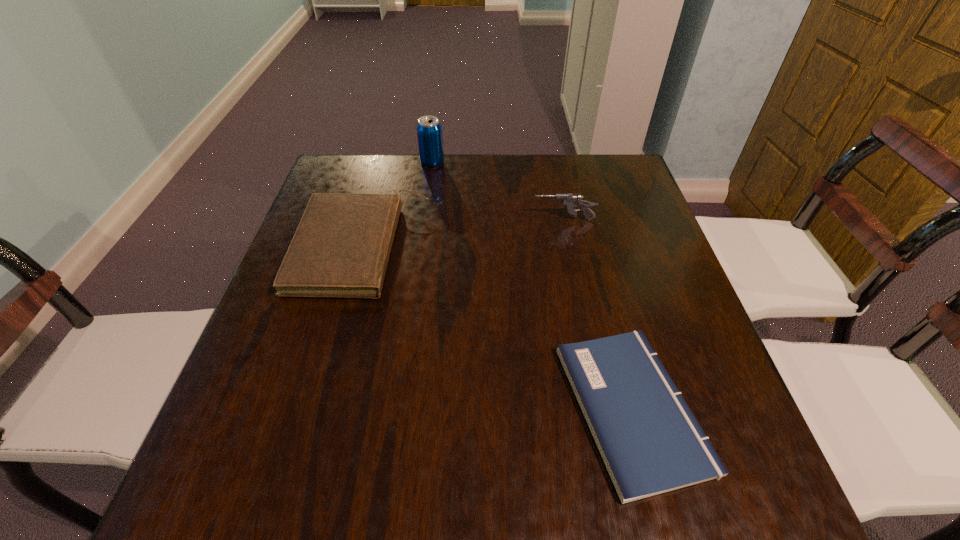
The image size is (960, 540). I want to click on the tallest object, so click(429, 130).

Identify the location of the farthest object. The image size is (960, 540). (429, 130).

Identify the location of the third shortest object. The width and height of the screenshot is (960, 540). (570, 201).

Find the location of a particular element. the taller paperback book is located at coordinates (341, 247).

Find the location of a particular element. The width and height of the screenshot is (960, 540). the third tallest object is located at coordinates (341, 247).

Identify the location of the shorter paperback book. (651, 443).

Image resolution: width=960 pixels, height=540 pixels. Identify the location of the nearer paperback book. (651, 443).

What are the coordinates of `blank space located 0.370m on the right of the pop soda` in the screenshot? It's located at (564, 163).

Image resolution: width=960 pixels, height=540 pixels. Find the location of `vacant area situated at the barrel of the gun`. vacant area situated at the barrel of the gun is located at coordinates (443, 220).

Identify the location of blank space located 0.350m at the barrel of the gun. (400, 220).